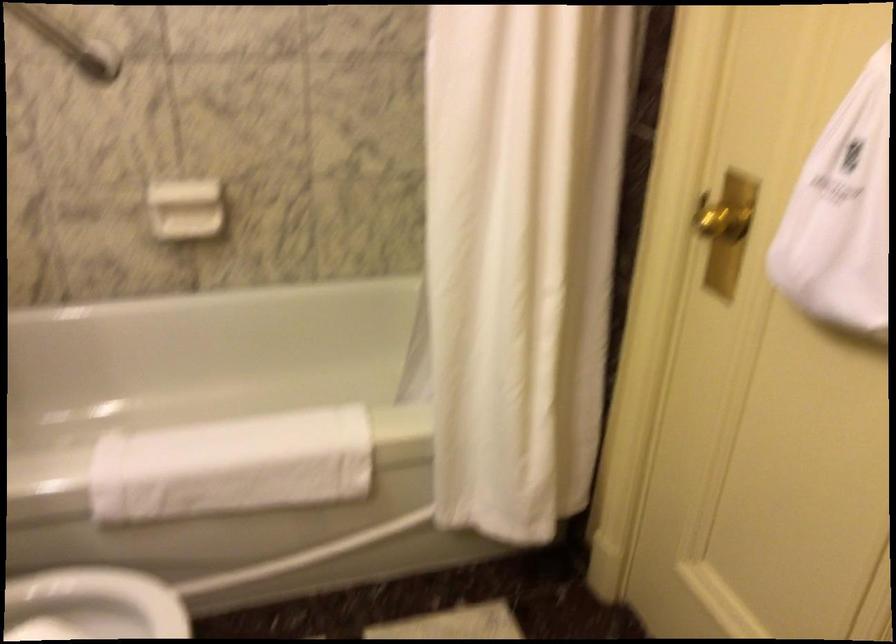
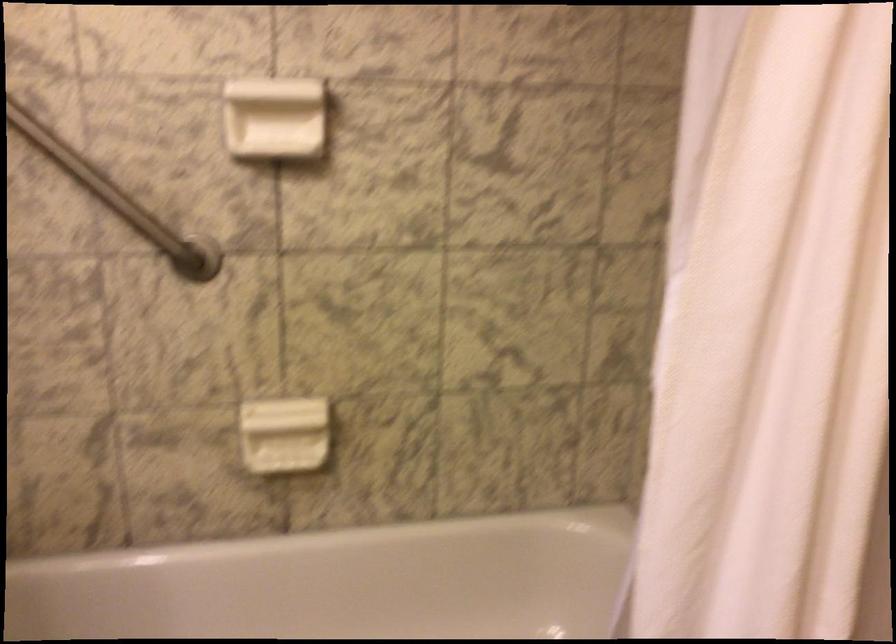
Question: Based on the continuous images, in which direction is the camera rotating? Reply with the corresponding letter.

Choices:
 (A) Left
 (B) Right
 (C) Up
 (D) Down

Answer: (C)